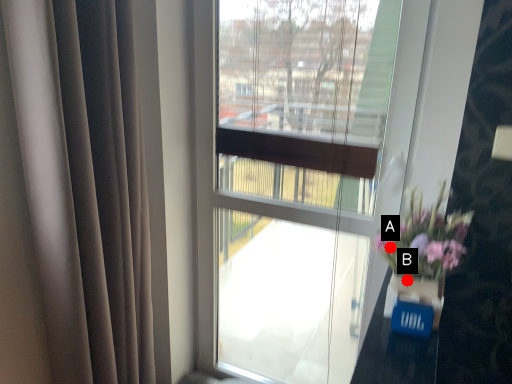
Question: Two points are circled on the image, labeled by A and B beside each circle. Which point is closer to the camera?

Choices:
 (A) A is closer
 (B) B is closer

Answer: (B)